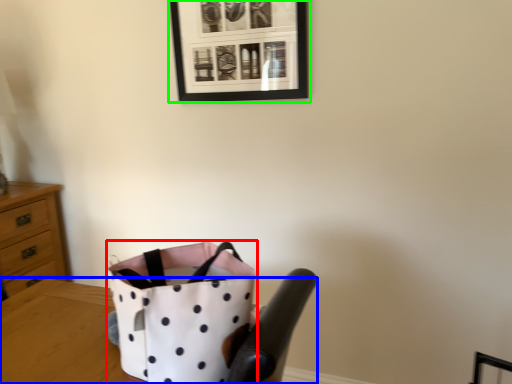
Question: Which object is the closest to the handbag (highlighted by a red box)? Choose among these: table (highlighted by a blue box) or picture frame (highlighted by a green box).

Choices:
 (A) table
 (B) picture frame

Answer: (A)